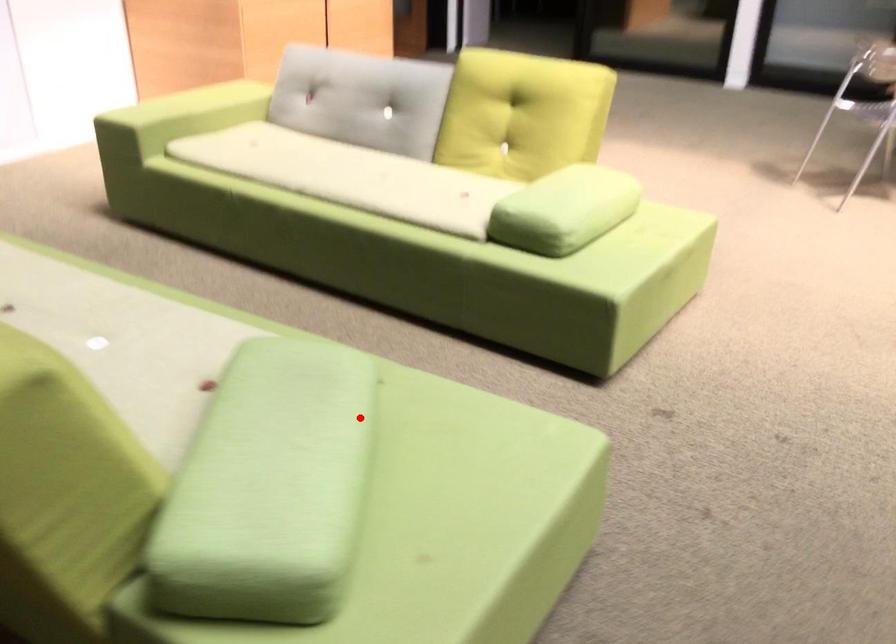
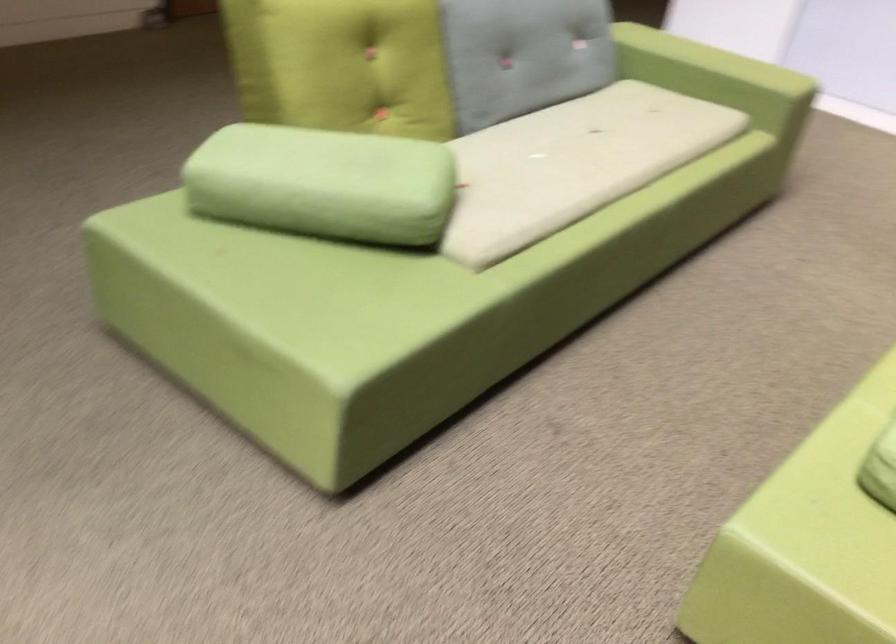
The point at the highlighted location is marked in the first image. Where is the corresponding point in the second image?

(323, 184)